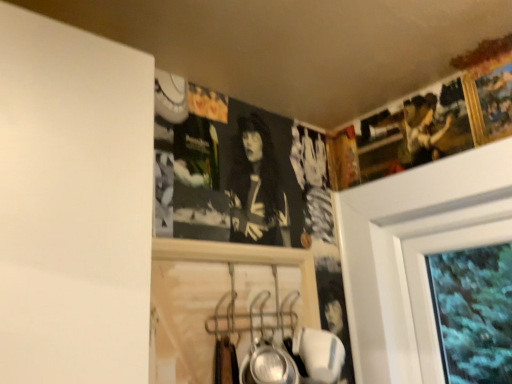
At what (x,y) coordinates should I click in order to perform the action: click on gold-framed painting at upper right. Please return your answer as a coordinate pair (x, y). The height and width of the screenshot is (384, 512). Looking at the image, I should click on (495, 99).

What is the approximate width of gold-framed painting at upper right?

gold-framed painting at upper right is 1.09 inches in width.

This screenshot has height=384, width=512. What do you see at coordinates (495, 99) in the screenshot?
I see `gold-framed painting at upper right` at bounding box center [495, 99].

This screenshot has height=384, width=512. Identify the location of gold-framed painting at upper right. (495, 99).